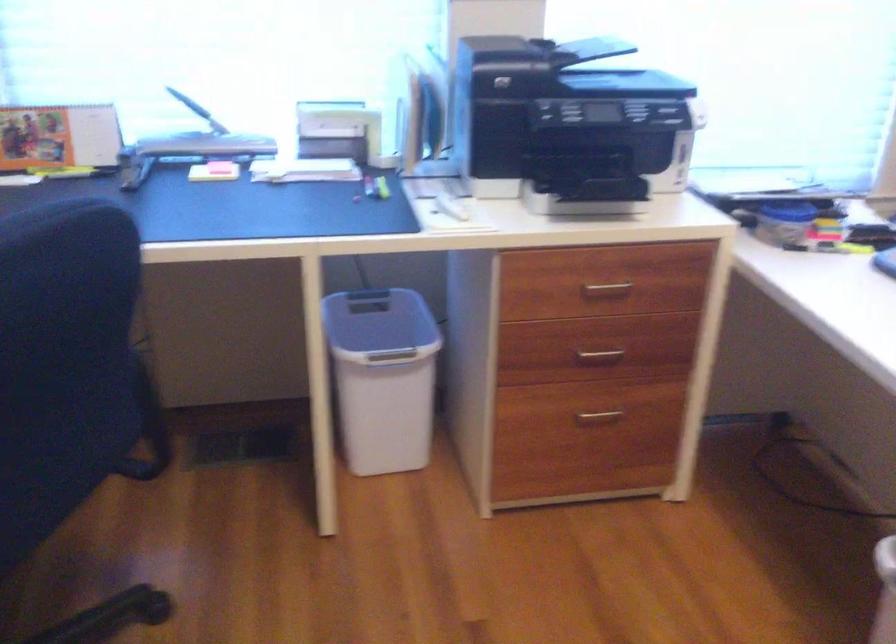
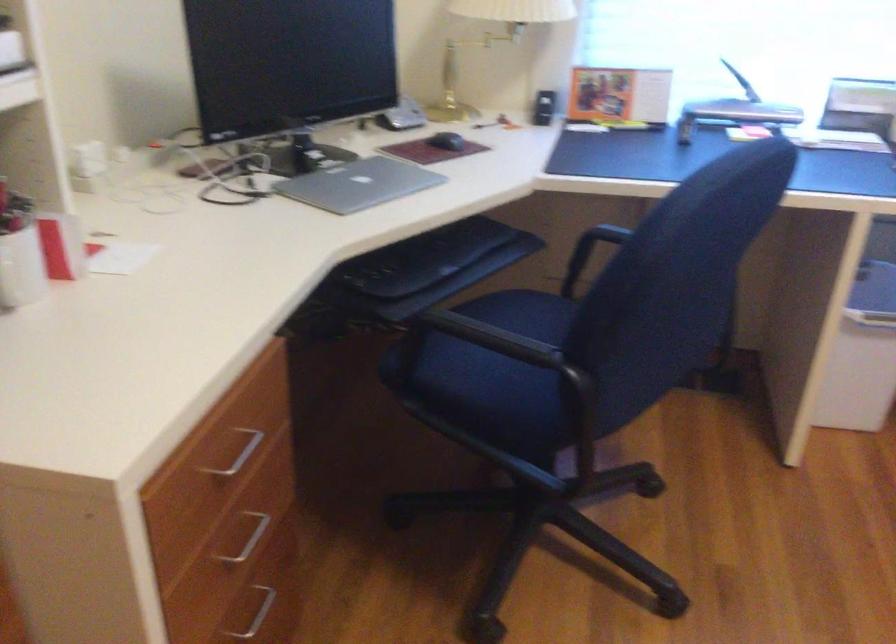
Where in the second image is the point corresponding to point (378, 399) from the first image?

(862, 355)